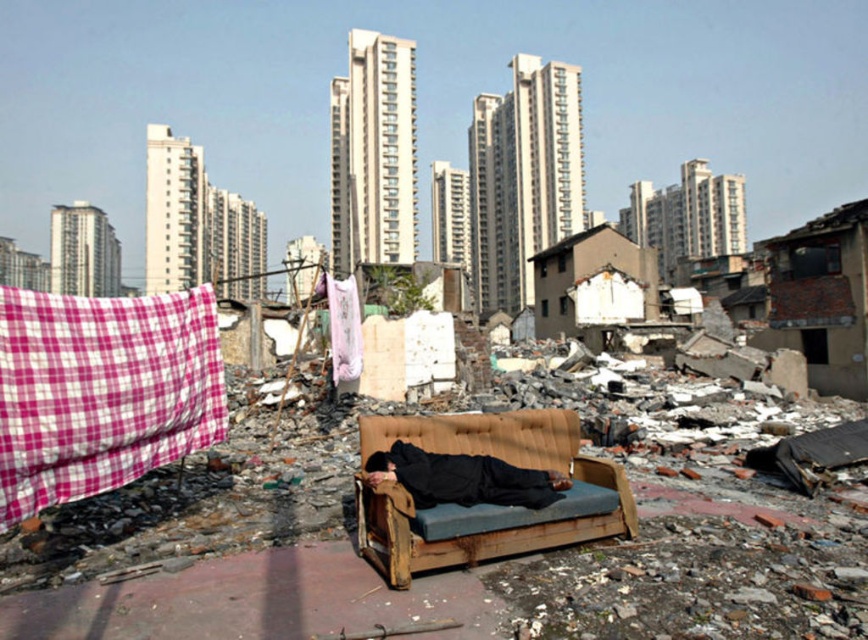
Is pink checkered fabric at left above black fabric person at center?

Indeed, pink checkered fabric at left is positioned over black fabric person at center.

Is pink checkered fabric at left smaller than black fabric person at center?

Actually, pink checkered fabric at left might be larger than black fabric person at center.

Does point (143, 333) lie behind point (389, 461)?

Yes, point (143, 333) is farther from viewer.

The width and height of the screenshot is (868, 640). What are the coordinates of `pink checkered fabric at left` in the screenshot? It's located at (102, 392).

What do you see at coordinates (485, 506) in the screenshot? I see `wooden couch at center` at bounding box center [485, 506].

Can you confirm if wooden couch at center is smaller than black fabric person at center?

Incorrect, wooden couch at center is not smaller in size than black fabric person at center.

Is point (458, 538) less distant than point (365, 481)?

Yes, point (458, 538) is in front of point (365, 481).

Where is `wooden couch at center`? The image size is (868, 640). wooden couch at center is located at coordinates (485, 506).

Who is positioned more to the right, pink checkered fabric at left or wooden couch at center?

wooden couch at center is more to the right.

Find the location of `pink checkered fabric at left`. pink checkered fabric at left is located at coordinates (102, 392).

Which is in front, point (110, 420) or point (378, 440)?

Positioned in front is point (110, 420).

The height and width of the screenshot is (640, 868). Identify the location of pink checkered fabric at left. [x=102, y=392].